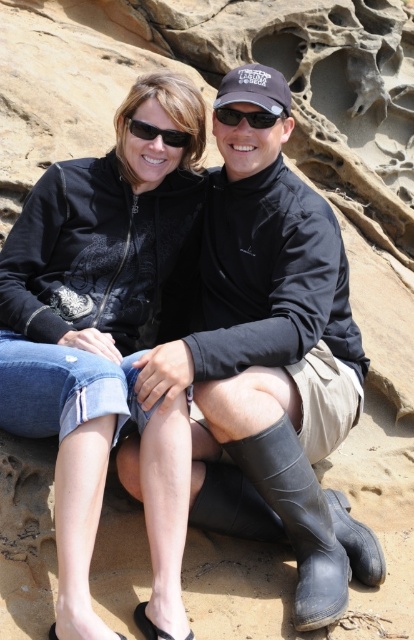
You are a photographer trying to capture a closeup of the black plastic sunglasses at upper center without the black rubber boot at lower center appearing in the frame. Given their sizes, which object should you focus on to ensure the boot doesn t block the view?

The black rubber boot at lower center is bigger than the black plastic sunglasses at upper center, so focusing on the sunglasses while keeping the boot out of the frame will prevent it from blocking the view.

You are a photographer trying to capture a closeup of the black plastic sunglasses at upper center without the black rubber boot at lower center appearing in the frame. Given their widths, is it possible to adjust the camera angle to achieve this?

The black rubber boot at lower center is wider than the black plastic sunglasses at upper center. By adjusting the camera angle to focus on the narrower sunglasses while avoiding the wider boot, it might be possible to exclude the boot from the frame.

You are a photographer trying to capture a closeup of the two people in the image. You notice both the black matte sunglasses at upper center and the black plastic sunglasses at upper center. Which pair of sunglasses has a smaller width?

The black matte sunglasses at upper center has a lesser width compared to the black plastic sunglasses at upper center.